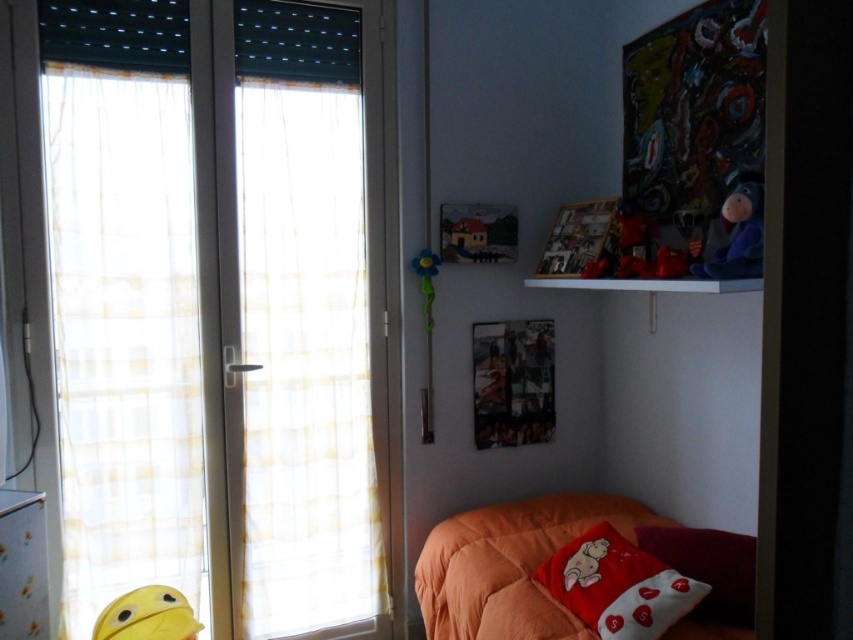
You are trying to decide whether to place a new rectangular bookcase in the room. The bookcase is 1.2 meters wide. You see the white cotton pillow at lower right and the white glossy dresser at lower left. Which object should you compare the bookcase width to determine if it will fit in the space between them?

The white cotton pillow at lower right might be wider than the white glossy dresser at lower left, so you should compare the bookcase width to the white cotton pillow at lower right to ensure it fits within the available space.

You are arranging a child room and want to place a new toy between the white cotton pillow at lower right and the white glossy dresser at lower left. Can you fit it there?

The white cotton pillow at lower right is positioned on the right side of the white glossy dresser at lower left, so there is space between them to place the new toy.

From the picture: You are sitting on the floor in the corner of the room and see both the red plush pillow at lower right and the velvety blue plush at upper right. Which one is nearer to you?

The red plush pillow at lower right is closer to the viewer than the velvety blue plush at upper right, so the red plush pillow at lower right is nearer to you.